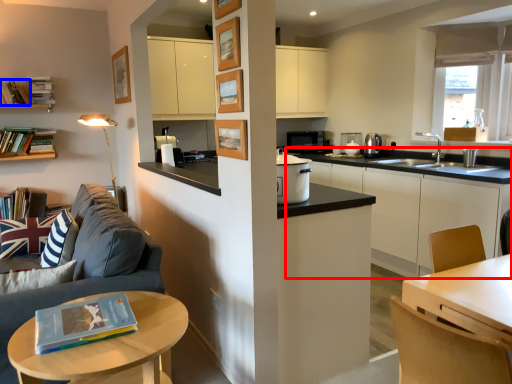
Question: Which point is closer to the camera, cabinetry (highlighted by a red box) or book (highlighted by a blue box)?

Choices:
 (A) cabinetry
 (B) book

Answer: (A)